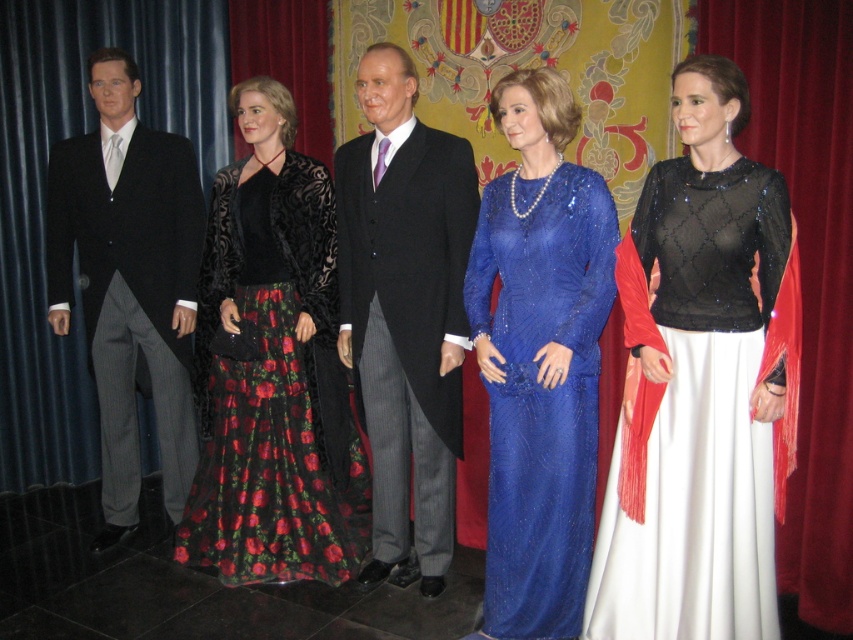
Between point (260, 371) and point (459, 260), which one is positioned in front?

Point (459, 260)

Who is more forward, (x=318, y=500) or (x=343, y=262)?

Point (x=343, y=262) is more forward.

You are a GUI agent. You are given a task and a screenshot of the screen. Output one action in this format:
    pyautogui.click(x=<x>, y=<y>)
    Task: Click on the velvet black dress at center
    The height and width of the screenshot is (640, 853).
    Given the screenshot: What is the action you would take?
    pyautogui.click(x=273, y=369)

Is velvet black dress at center bigger than blue sequined dress at center?

Yes.

This screenshot has width=853, height=640. In order to click on velvet black dress at center in this screenshot , I will do `click(273, 369)`.

Which is in front, point (666, 397) or point (527, 176)?

Point (666, 397) is more forward.

The height and width of the screenshot is (640, 853). I want to click on black sequined dress at center, so click(x=700, y=410).